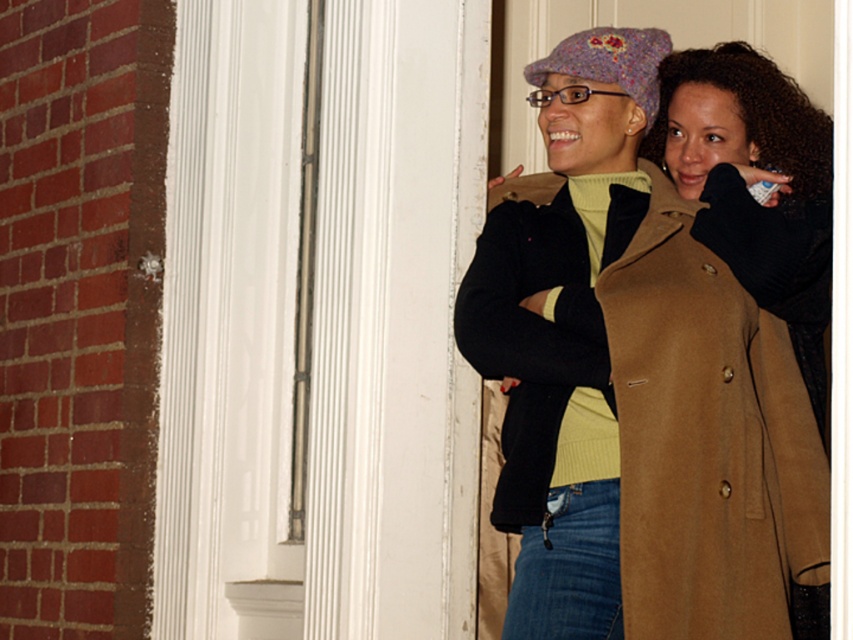
Which of these two, tan woolen trench coat at center or brown woolen coat at center, stands taller?

tan woolen trench coat at center is taller.

Which is more to the left, tan woolen trench coat at center or brown woolen coat at center?

brown woolen coat at center

Is point (695, 525) positioned before point (514, 467)?

Yes, it is.

The width and height of the screenshot is (853, 640). Identify the location of tan woolen trench coat at center. (706, 440).

Does brown woolen coat at center have a larger size compared to denim at lower right?

Yes, brown woolen coat at center is bigger than denim at lower right.

Is point (496, 260) more distant than point (550, 513)?

Yes, it is behind point (550, 513).

Who is more distant from viewer, (497, 230) or (572, 515)?

Point (497, 230)

The width and height of the screenshot is (853, 640). Find the location of `brown woolen coat at center`. brown woolen coat at center is located at coordinates (531, 339).

Does tan woolen trench coat at center have a lesser width compared to denim at lower right?

No.

You are a GUI agent. You are given a task and a screenshot of the screen. Output one action in this format:
    pyautogui.click(x=<x>, y=<y>)
    Task: Click on the tan woolen trench coat at center
    
    Given the screenshot: What is the action you would take?
    pyautogui.click(x=706, y=440)

Between point (654, 387) and point (514, 589), which one is positioned in front?

Point (654, 387) is in front.

At what (x,y) coordinates should I click in order to perform the action: click on tan woolen trench coat at center. Please return your answer as a coordinate pair (x, y). This screenshot has height=640, width=853. Looking at the image, I should click on (706, 440).